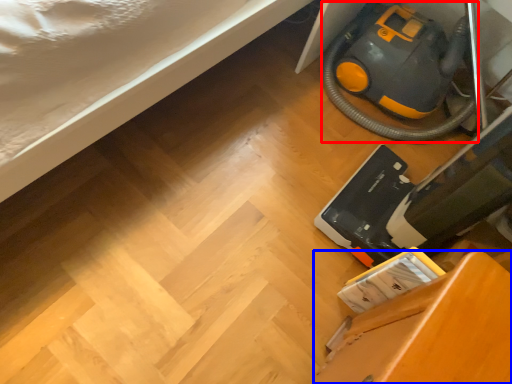
Question: Which of the following is the farthest to the observer, equipment (highlighted by a red box) or furniture (highlighted by a blue box)?

Choices:
 (A) equipment
 (B) furniture

Answer: (A)